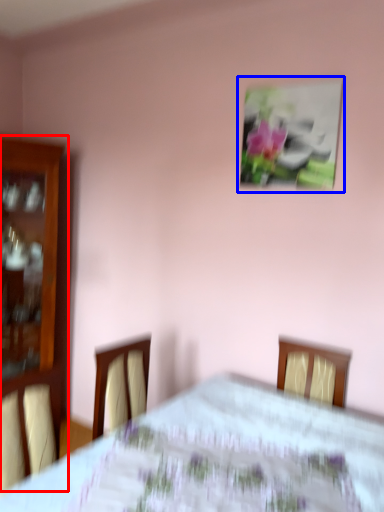
Question: Among these objects, which one is nearest to the camera, furniture (highlighted by a red box) or picture frame (highlighted by a blue box)?

Choices:
 (A) furniture
 (B) picture frame

Answer: (B)